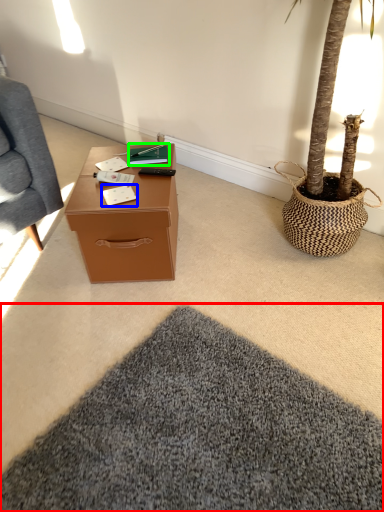
Question: Estimate the real-world distances between objects in this image. Which object is closer to mat (highlighted by a red box), notepad (highlighted by a blue box) or book (highlighted by a green box)?

Choices:
 (A) notepad
 (B) book

Answer: (A)